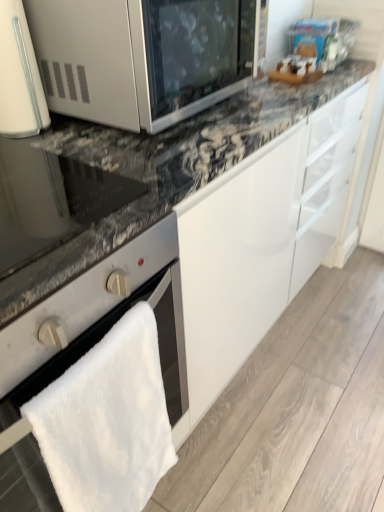
Where is `free spot above matte black oven at left (from a real-world perspective)`? The image size is (384, 512). free spot above matte black oven at left (from a real-world perspective) is located at coordinates (39, 176).